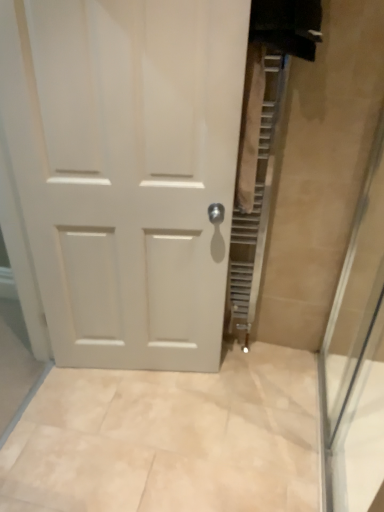
You are a GUI agent. You are given a task and a screenshot of the screen. Output one action in this format:
    pyautogui.click(x=<x>, y=<y>)
    Task: Click on the vacant space in front of white matte door at center
    Image resolution: width=384 pixels, height=512 pixels.
    Given the screenshot: What is the action you would take?
    pyautogui.click(x=135, y=439)